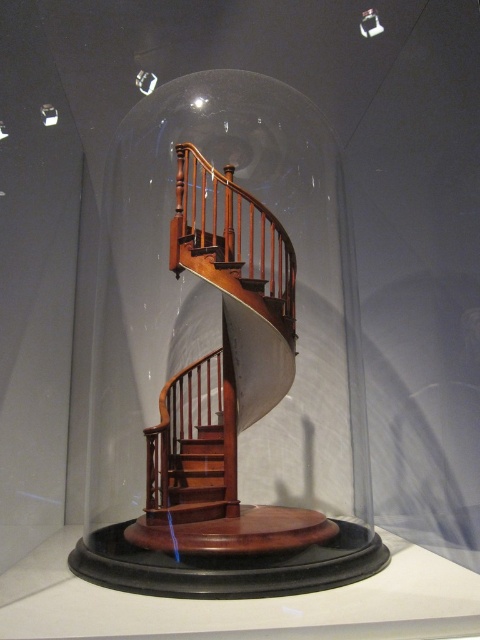
Is mahogany wood railing at center below mahogany wood stairs at center?

No.

Does mahogany wood railing at center appear on the left side of mahogany wood stairs at center?

No, mahogany wood railing at center is not to the left of mahogany wood stairs at center.

The height and width of the screenshot is (640, 480). Describe the element at coordinates (231, 241) in the screenshot. I see `mahogany wood railing at center` at that location.

This screenshot has width=480, height=640. Identify the location of mahogany wood railing at center. (231, 241).

Is transparent glass dome at center thinner than mahogany wood stairs at center?

No, transparent glass dome at center is not thinner than mahogany wood stairs at center.

Between transparent glass dome at center and mahogany wood stairs at center, which one appears on the right side from the viewer's perspective?

From the viewer's perspective, transparent glass dome at center appears more on the right side.

Does point (76, 564) come closer to viewer compared to point (205, 483)?

Yes, it is in front of point (205, 483).

Identify the location of transparent glass dome at center. Image resolution: width=480 pixels, height=640 pixels. (227, 353).

Describe the element at coordinates (227, 353) in the screenshot. I see `transparent glass dome at center` at that location.

Describe the element at coordinates (227, 353) in the screenshot. I see `transparent glass dome at center` at that location.

Identify the location of transparent glass dome at center. (227, 353).